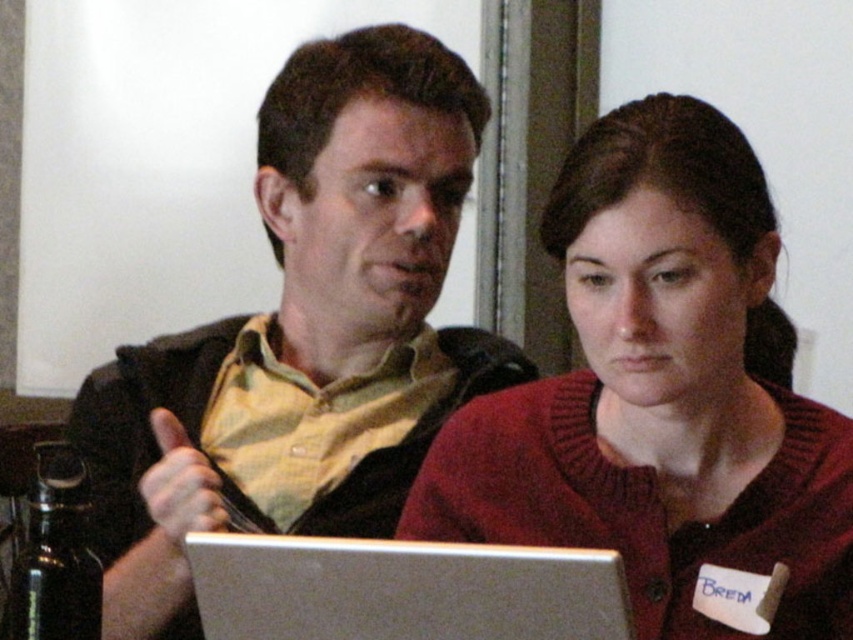
Who is positioned more to the left, matte black laptop at center or silver metallic laptop at center?

matte black laptop at center

Does matte black laptop at center appear on the right side of silver metallic laptop at center?

In fact, matte black laptop at center is to the left of silver metallic laptop at center.

What do you see at coordinates (303, 333) in the screenshot?
I see `matte black laptop at center` at bounding box center [303, 333].

This screenshot has width=853, height=640. In order to click on matte black laptop at center in this screenshot , I will do `click(303, 333)`.

Who is more forward, (x=618, y=524) or (x=331, y=600)?

Point (x=331, y=600) is in front.

Is point (834, 604) positioned before point (257, 611)?

No, (834, 604) is behind (257, 611).

Find the location of `knitted red sweater at center`. knitted red sweater at center is located at coordinates (659, 394).

Who is more forward, (331,324) or (570,298)?

Point (570,298)

Which is above, matte black laptop at center or knitted red sweater at center?

matte black laptop at center

What do you see at coordinates (303, 333) in the screenshot?
I see `matte black laptop at center` at bounding box center [303, 333].

Find the location of a particular element. matte black laptop at center is located at coordinates (303, 333).